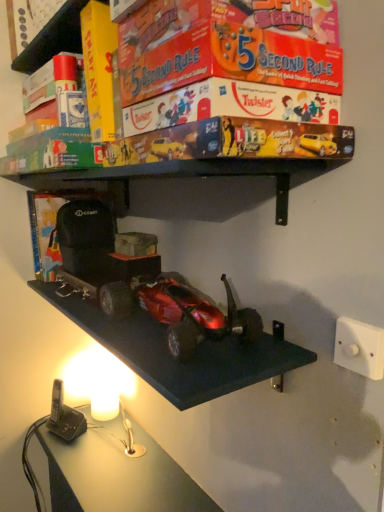
Question: Would you say shiny metallic car at center is part of matt board game at upper center's contents?

Choices:
 (A) yes
 (B) no

Answer: (B)

Question: Is matt board game at upper center wider than shiny metallic car at center?

Choices:
 (A) yes
 (B) no

Answer: (A)

Question: From a real-world perspective, is matt board game at upper center over shiny metallic car at center?

Choices:
 (A) yes
 (B) no

Answer: (A)

Question: Does matt board game at upper center have a smaller size compared to shiny metallic car at center?

Choices:
 (A) no
 (B) yes

Answer: (A)

Question: Is matt board game at upper center not close to shiny metallic car at center?

Choices:
 (A) yes
 (B) no

Answer: (B)

Question: Is matt board game at upper center oriented away from shiny metallic car at center?

Choices:
 (A) no
 (B) yes

Answer: (A)

Question: Does white plastic/light switch at lower right have a greater width compared to shiny metallic car at center?

Choices:
 (A) yes
 (B) no

Answer: (B)

Question: Is white plastic/light switch at lower right outside shiny metallic car at center?

Choices:
 (A) no
 (B) yes

Answer: (B)

Question: Considering the relative sizes of white plastic/light switch at lower right and shiny metallic car at center in the image provided, is white plastic/light switch at lower right smaller than shiny metallic car at center?

Choices:
 (A) yes
 (B) no

Answer: (A)

Question: Considering the relative positions of white plastic/light switch at lower right and shiny metallic car at center in the image provided, is white plastic/light switch at lower right to the left of shiny metallic car at center from the viewer's perspective?

Choices:
 (A) no
 (B) yes

Answer: (A)

Question: Is shiny metallic car at center at the back of white plastic/light switch at lower right?

Choices:
 (A) yes
 (B) no

Answer: (B)

Question: Can you confirm if white plastic/light switch at lower right is taller than shiny metallic car at center?

Choices:
 (A) no
 (B) yes

Answer: (A)

Question: From the image's perspective, does shiny metallic car at center appear lower than white plastic/light switch at lower right?

Choices:
 (A) no
 (B) yes

Answer: (A)